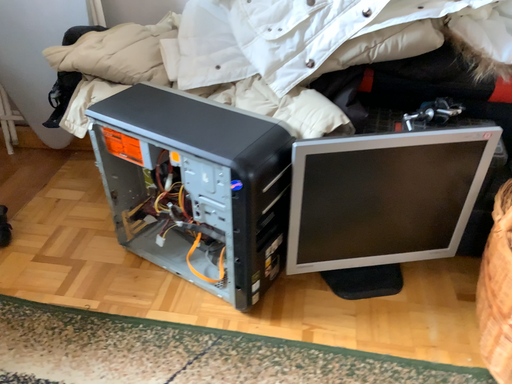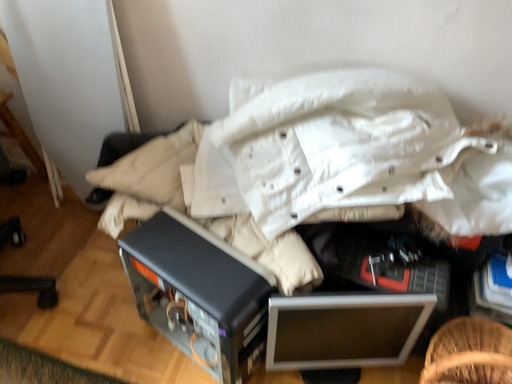
Question: How did the camera likely rotate when shooting the video?

Choices:
 (A) rotated downward
 (B) rotated upward

Answer: (A)